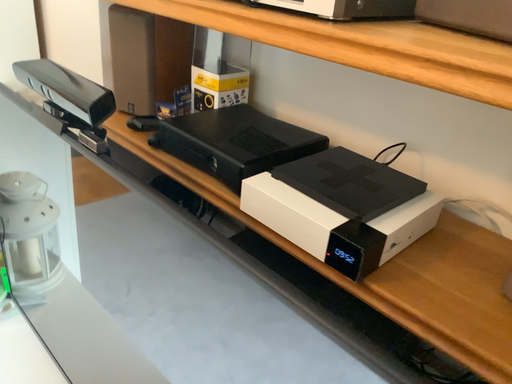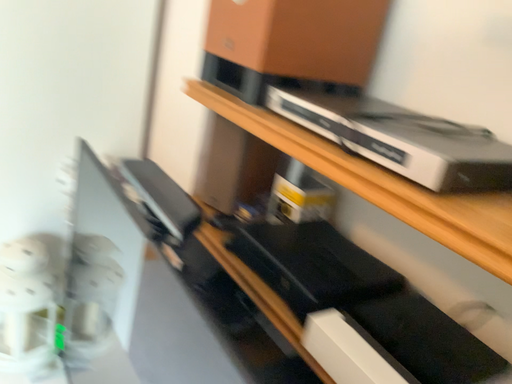
Question: Which way did the camera rotate in the video?

Choices:
 (A) rotated right
 (B) rotated left

Answer: (B)